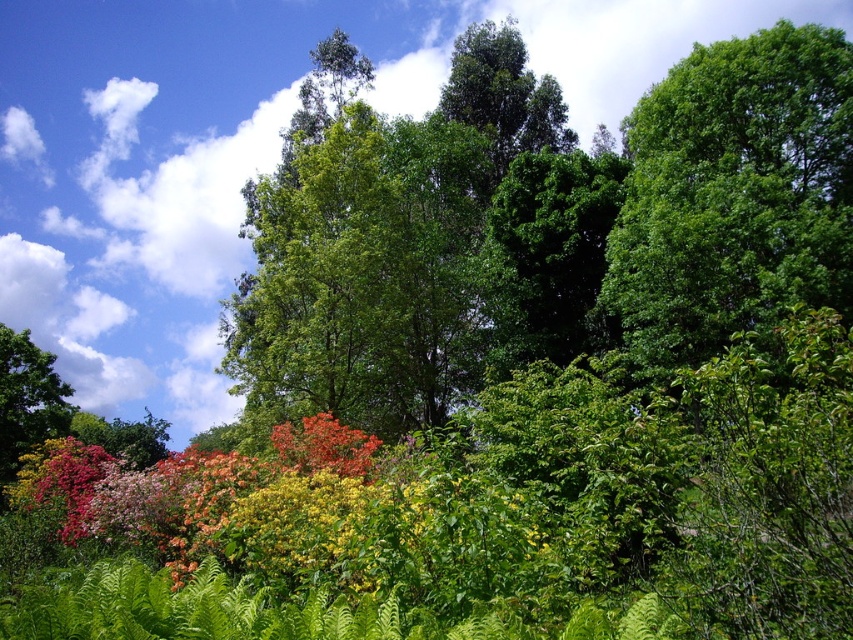
Question: Can you confirm if multicolored foliage at center is positioned above vivid orange leaves at center?

Choices:
 (A) yes
 (B) no

Answer: (B)

Question: Can you confirm if multicolored foliage at center is smaller than vivid orange leaves at center?

Choices:
 (A) yes
 (B) no

Answer: (B)

Question: Which object is positioned closest to the multicolored foliage at center?

Choices:
 (A) green leafy tree at upper right
 (B) vivid orange leaves at center

Answer: (B)

Question: Which point is farther from the camera taking this photo?

Choices:
 (A) (296, 493)
 (B) (318, 416)

Answer: (B)

Question: Can you confirm if green leafy tree at upper right is bigger than vivid orange leaves at center?

Choices:
 (A) no
 (B) yes

Answer: (B)

Question: Which is nearer to the multicolored foliage at center?

Choices:
 (A) green leafy tree at upper right
 (B) vivid orange leaves at center

Answer: (B)